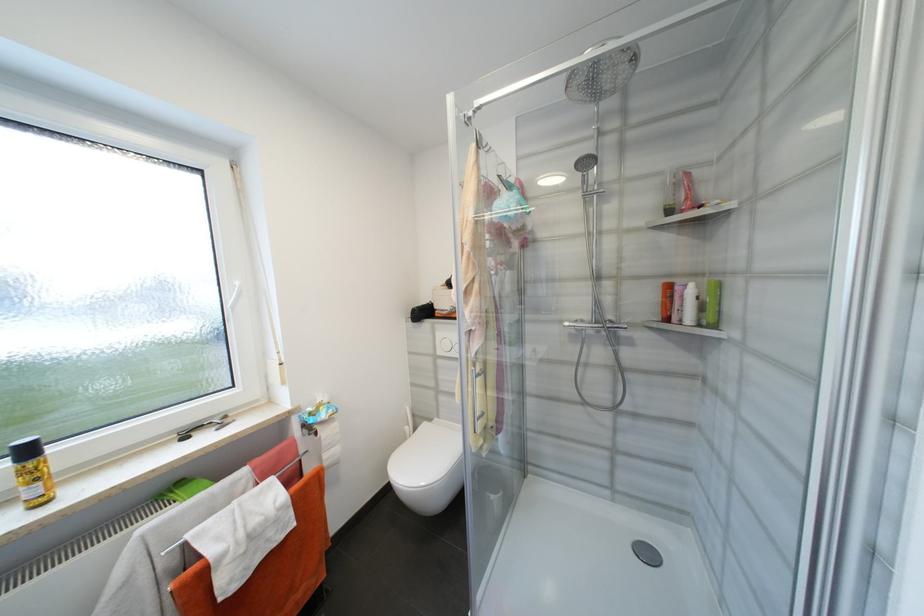
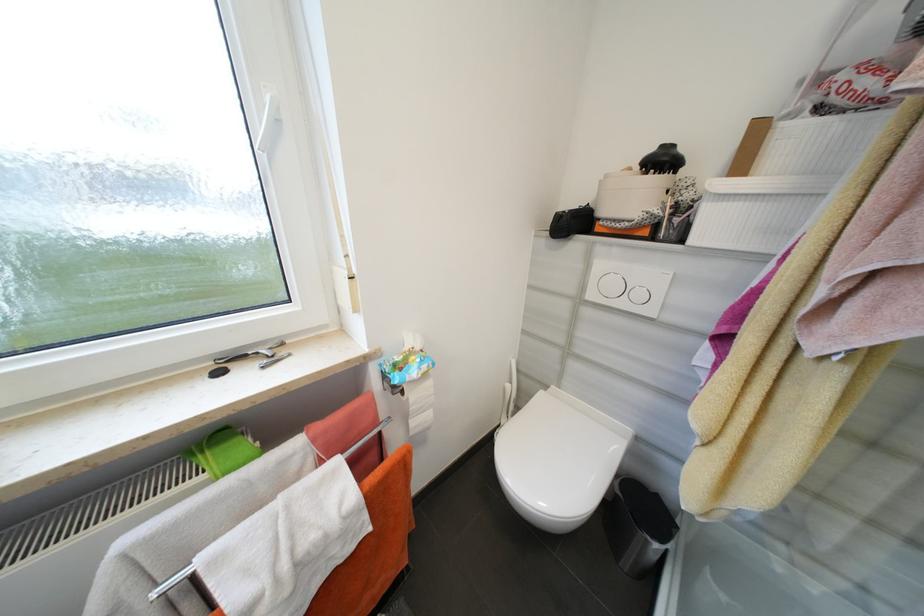
In the second image, find the point that corresponds to point (322, 435) in the first image.

(407, 392)